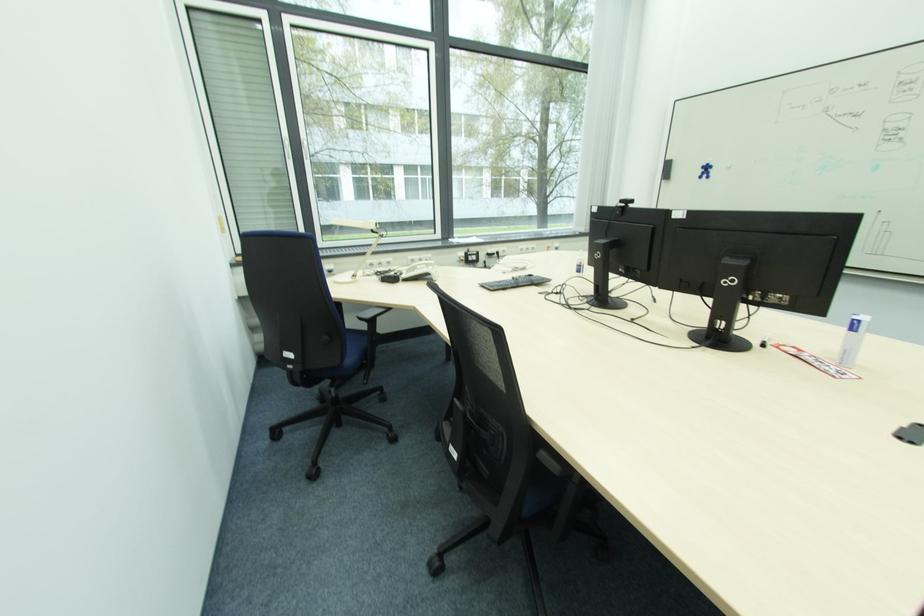
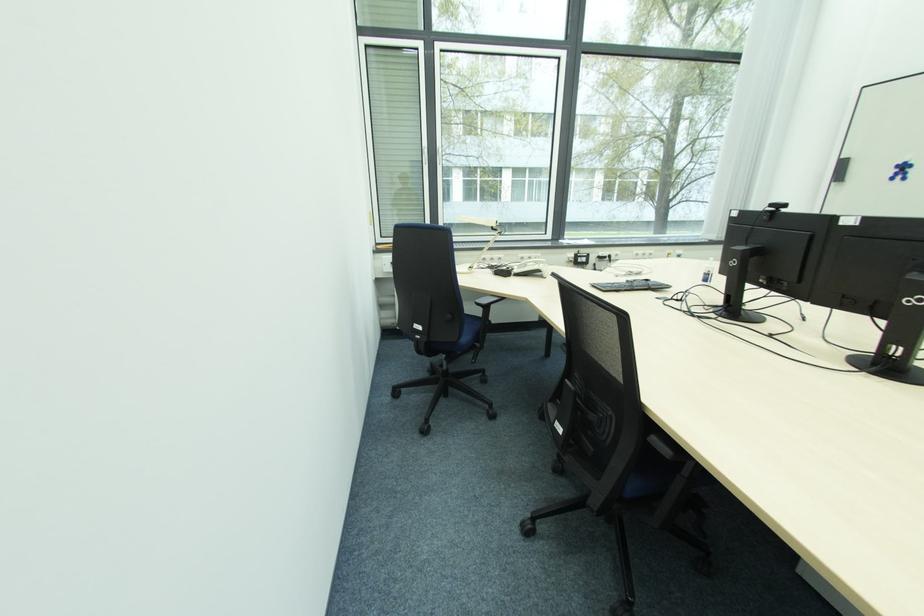
The point at (408, 274) is marked in the first image. Where is the corresponding point in the second image?

(519, 270)